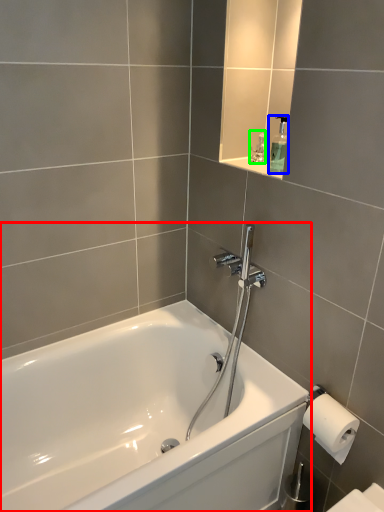
Question: Based on their relative distances, which object is farther from bathtub (highlighted by a red box)? Choose from soap dispenser (highlighted by a blue box) and toiletry (highlighted by a green box).

Choices:
 (A) soap dispenser
 (B) toiletry

Answer: (B)